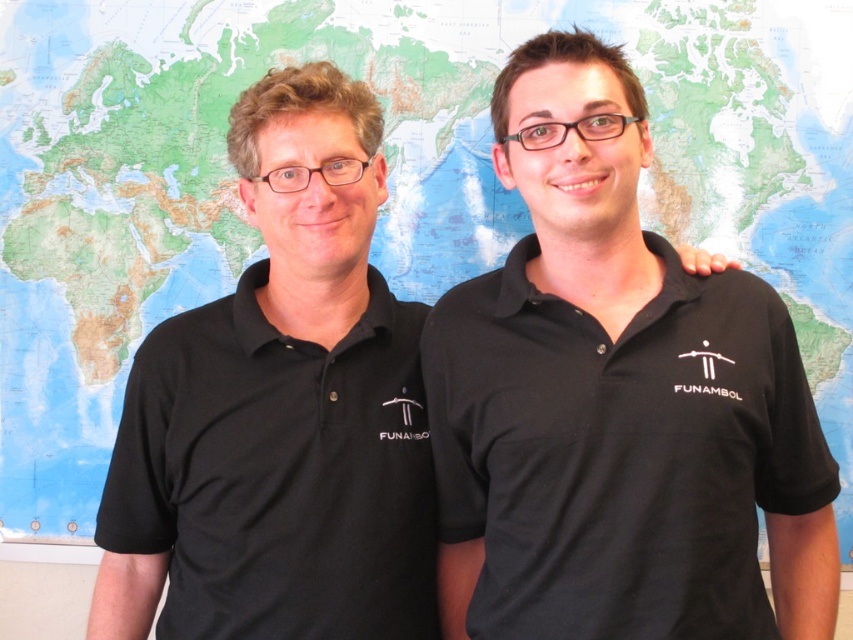
You are a photographer standing 3 meters away from the two people at point (587, 525). You want to take a photo that includes both of them in the frame. Given that your camera has a 50mm lens with a field of view of 46 degrees, will you be able to capture both individuals in a single shot?

The two individuals at point (587, 525) are 1.08 meters apart. With a 50mm lens and a 46 degree field of view, the maximum width you can capture from 3 meters away is approximately 2.5 meters. Since 1.08 meters is less than 2.5 meters, both individuals will fit within the frame.

You are an observer looking at the scene described. There is a black matte shirt at right. Where exactly is it positioned in terms of coordinates?

The black matte shirt at right is located at point (616, 403).

Based on the photo, you are standing in front of the world map and see two points marked on it. The first point is at coordinates point (460, 413) and the second is at point (228, 529). Which point is closer to you?

Point (460, 413) is in front of point (228, 529), so it is closer to you.